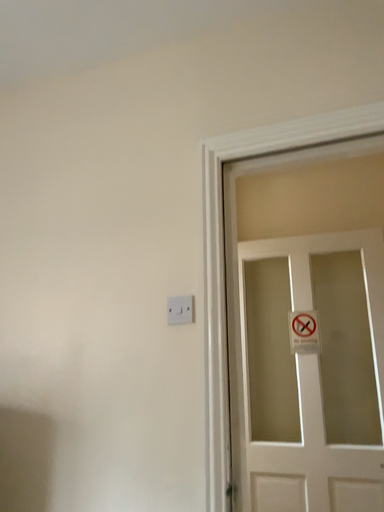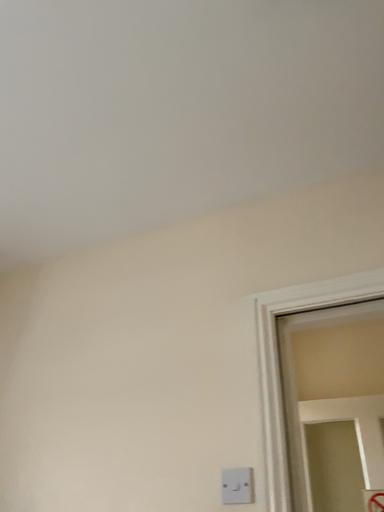
Question: Which way did the camera rotate in the video?

Choices:
 (A) rotated left
 (B) rotated right

Answer: (A)